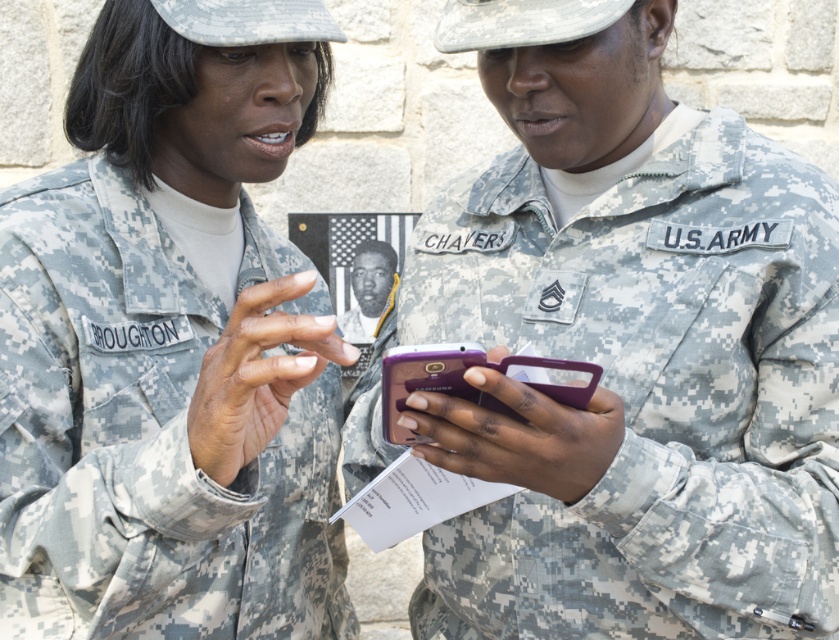
Which is more to the right, camouflage uniform at center or black matte photograph at center?

black matte photograph at center is more to the right.

Which is behind, point (209, 141) or point (373, 273)?

The point (373, 273) is more distant.

You are a GUI agent. You are given a task and a screenshot of the screen. Output one action in this format:
    pyautogui.click(x=<x>, y=<y>)
    Task: Click on the camouflage uniform at center
    This screenshot has height=640, width=839.
    Given the screenshot: What is the action you would take?
    pyautogui.click(x=170, y=342)

Is point (279, 20) farther from camera compared to point (821, 612)?

That is True.

How distant is camouflage uniform at center from camouflage fabric us army uniform at center?

A distance of 43.52 centimeters exists between camouflage uniform at center and camouflage fabric us army uniform at center.

Does point (89, 292) come closer to viewer compared to point (717, 483)?

No, it is not.

Locate an element on the screen. camouflage uniform at center is located at coordinates (170, 342).

This screenshot has height=640, width=839. Describe the element at coordinates (650, 394) in the screenshot. I see `camouflage fabric us army uniform at center` at that location.

The image size is (839, 640). I want to click on camouflage fabric us army uniform at center, so click(650, 394).